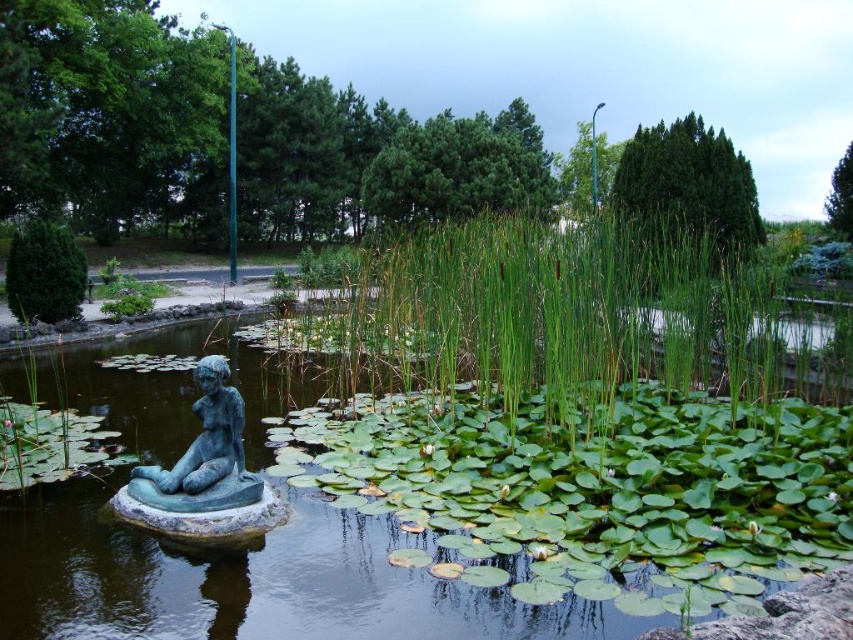
You are a maintenance worker needing to move both the green patina statue at left and the green patina statue at lower left. The path between them is narrow. Can you pass through the space between them while carrying a 1.5 meter wide equipment? Please explain based on their distance.

The green patina statue at left and the green patina statue at lower left are 1.46 meters apart. Since the equipment is 1.5 meters wide, it is slightly wider than the gap between the statues. Therefore, you cannot pass through the space between them with the equipment.

You are a gardener who wants to place a new decorative item in the pond. You have two options to choose from. One is the green grassy reed at center and the other is the green patina statue at lower left. Which object should you choose if you want to place a larger decorative item in the pond?

The green grassy reed at center has a larger size compared to the green patina statue at lower left, so you should choose the green grassy reed at center if you want to place a larger decorative item in the pond.